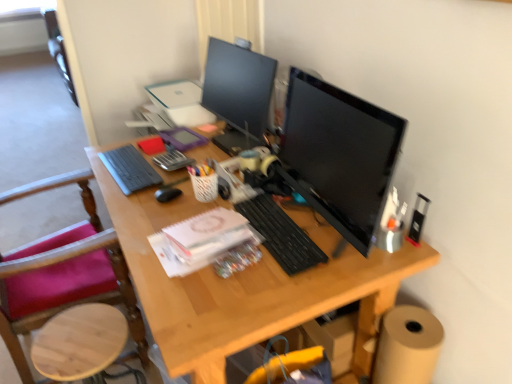
This screenshot has height=384, width=512. What are the coordinates of `vacant point above black matte keyboard at center, the 1th computer keyboard from the front (from a real-world perspective)` in the screenshot? It's located at (280, 239).